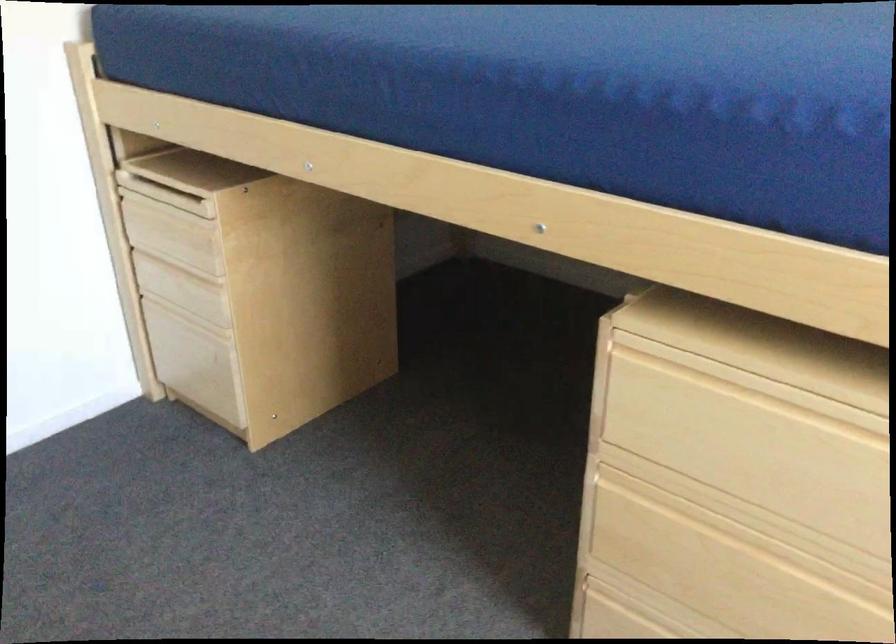
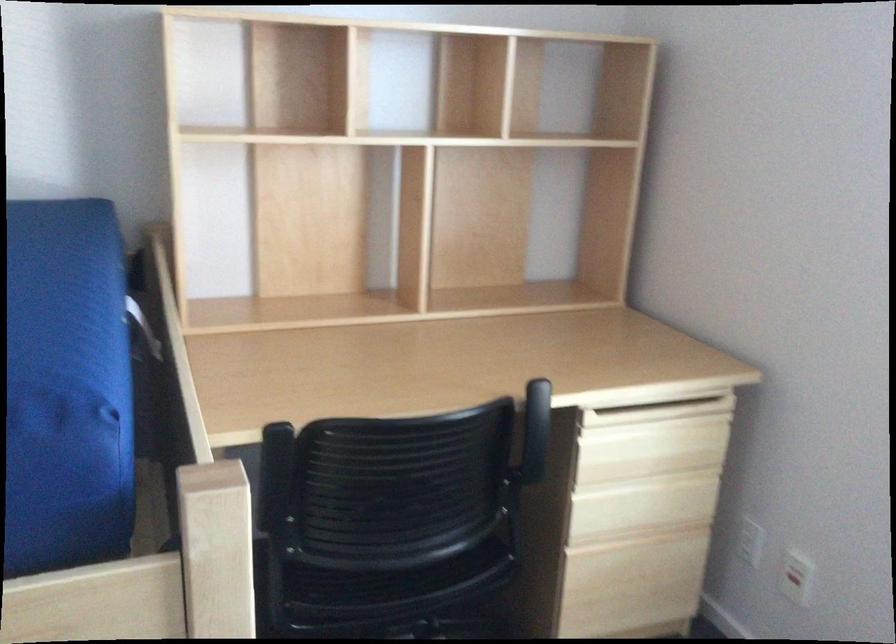
Question: The first image is from the beginning of the video and the second image is from the end. How did the camera likely rotate when shooting the video?

Choices:
 (A) Left
 (B) Right
 (C) Up
 (D) Down

Answer: (B)